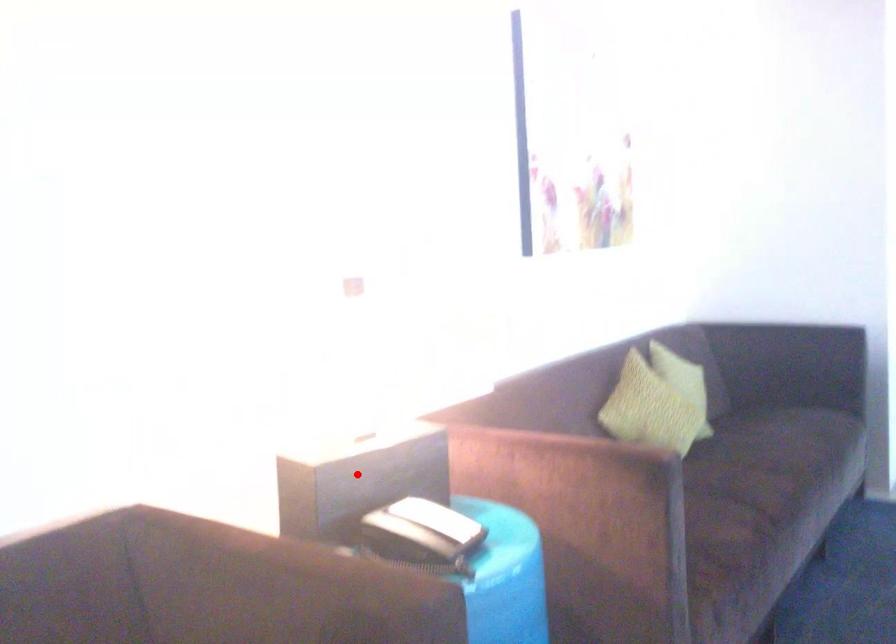
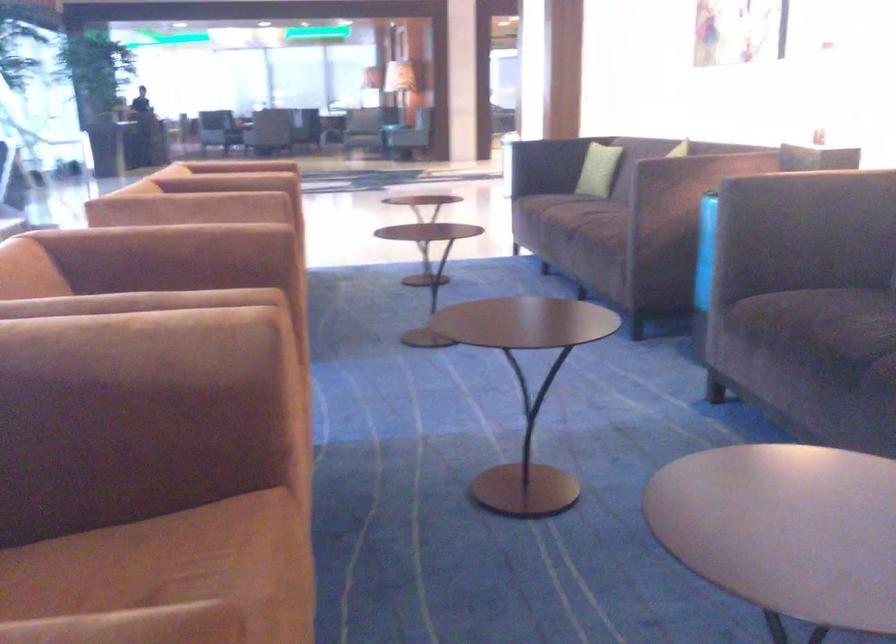
Question: I am providing you with two images of the same scene from different viewpoints. A red point is marked on the first image. Can you still see the location of the red point in image 2?

Choices:
 (A) Yes
 (B) No

Answer: (B)